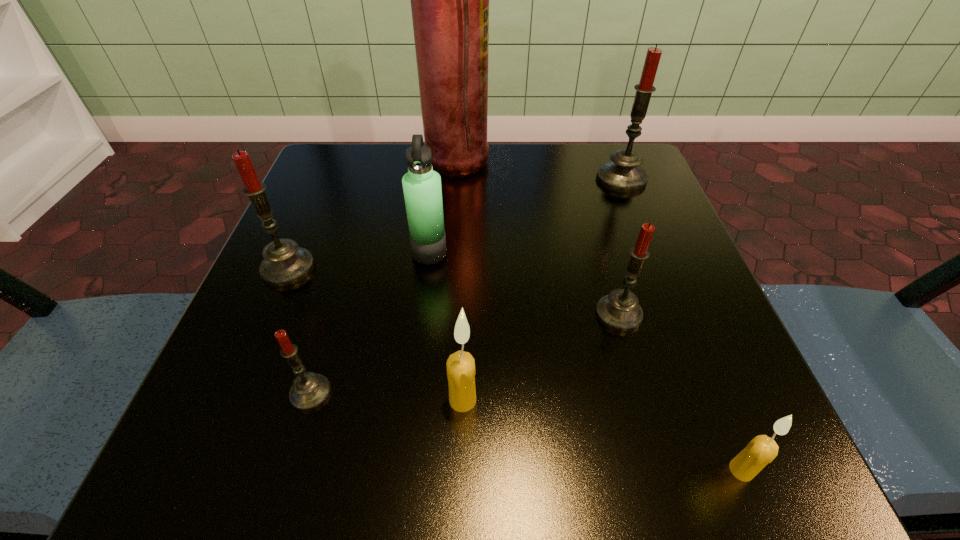
Image resolution: width=960 pixels, height=540 pixels. Identify the location of the left cream candle. (461, 372).

The image size is (960, 540). Identify the location of the third red candle from right to left. (309, 390).

In order to click on the seventh object from right to left in this screenshot , I will do `click(309, 390)`.

Where is `the right cream candle`? Image resolution: width=960 pixels, height=540 pixels. the right cream candle is located at coordinates (760, 451).

The height and width of the screenshot is (540, 960). What are the coordinates of `the nearest object` in the screenshot? It's located at (760, 451).

Find the location of a particular element. The width and height of the screenshot is (960, 540). vacant position located 0.180m on the side of the red fire extinguisher with the label is located at coordinates (570, 164).

Locate an element on the screen. This screenshot has width=960, height=540. vacant area situated on the left of the farthest candle is located at coordinates (569, 179).

Image resolution: width=960 pixels, height=540 pixels. What are the coordinates of `vacant space located 0.060m on the front of the third smallest red candle` in the screenshot? It's located at (268, 315).

What are the coordinates of `vacant space located 0.240m on the front of the thermos bottle` in the screenshot? It's located at (414, 389).

The width and height of the screenshot is (960, 540). Find the location of `vacant point located on the front of the second smallest red candle`. vacant point located on the front of the second smallest red candle is located at coordinates (632, 361).